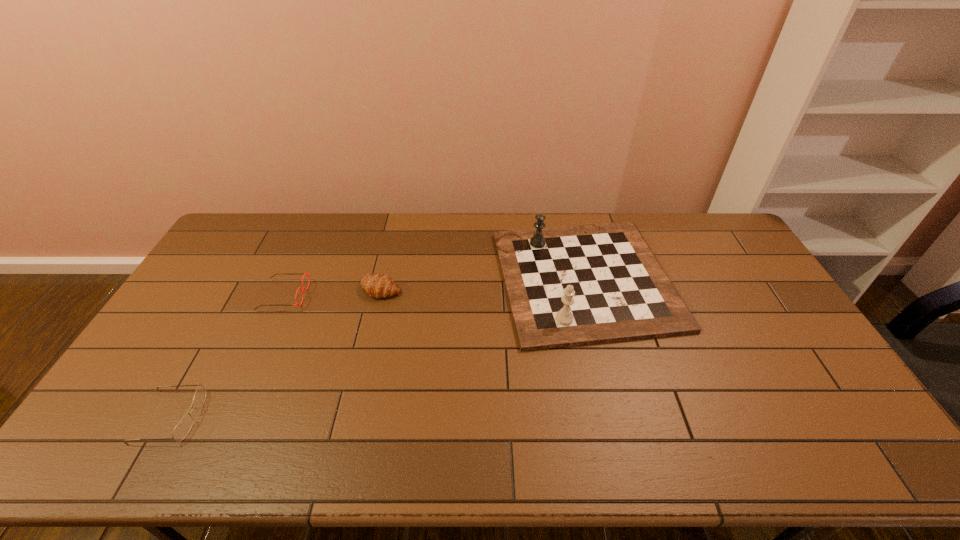
Identify the location of free space that satisfies the following two spatial constraints: 1. on the front side of the gameboard; 2. on the front-facing side of the farther spectacles. The image size is (960, 540). (588, 295).

Where is `vacant space that satisfies the following two spatial constraints: 1. on the front side of the third object from left to right; 2. on the front-facing side of the nearer spectacles`? This screenshot has height=540, width=960. vacant space that satisfies the following two spatial constraints: 1. on the front side of the third object from left to right; 2. on the front-facing side of the nearer spectacles is located at coordinates (351, 417).